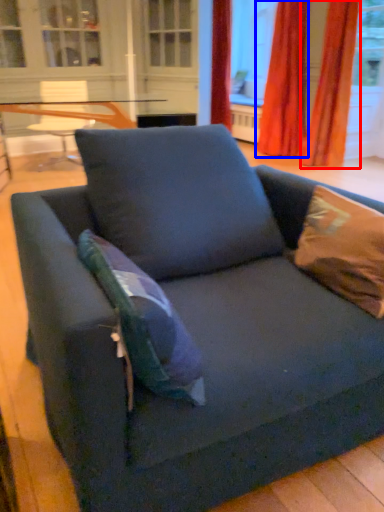
Question: Which object appears closest to the camera in this image, curtain (highlighted by a red box) or curtain (highlighted by a blue box)?

Choices:
 (A) curtain
 (B) curtain

Answer: (A)